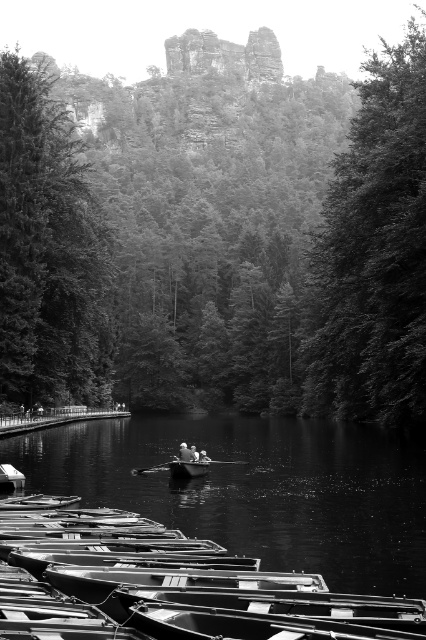
Question: Which point is closer to the camera taking this photo?

Choices:
 (A) (x=68, y=250)
 (B) (x=0, y=476)
 (C) (x=327, y=496)
 (D) (x=181, y=38)

Answer: (B)

Question: Can you confirm if dark green leafy tree at center is thinner than wooden rowboat at center?

Choices:
 (A) no
 (B) yes

Answer: (A)

Question: Does dark green textured tree at left lie in front of smooth wooden boat at lower left?

Choices:
 (A) yes
 (B) no

Answer: (B)

Question: In this image, where is smooth dark water at center located relative to wooden rowboat at center?

Choices:
 (A) above
 (B) below

Answer: (B)

Question: Which object is closer to the camera taking this photo?

Choices:
 (A) wooden rowboat at center
 (B) smooth dark water at center

Answer: (B)

Question: Which point is farther from the camera taking this photo?

Choices:
 (A) (287, 460)
 (B) (360, 172)
 (C) (51, 122)

Answer: (C)